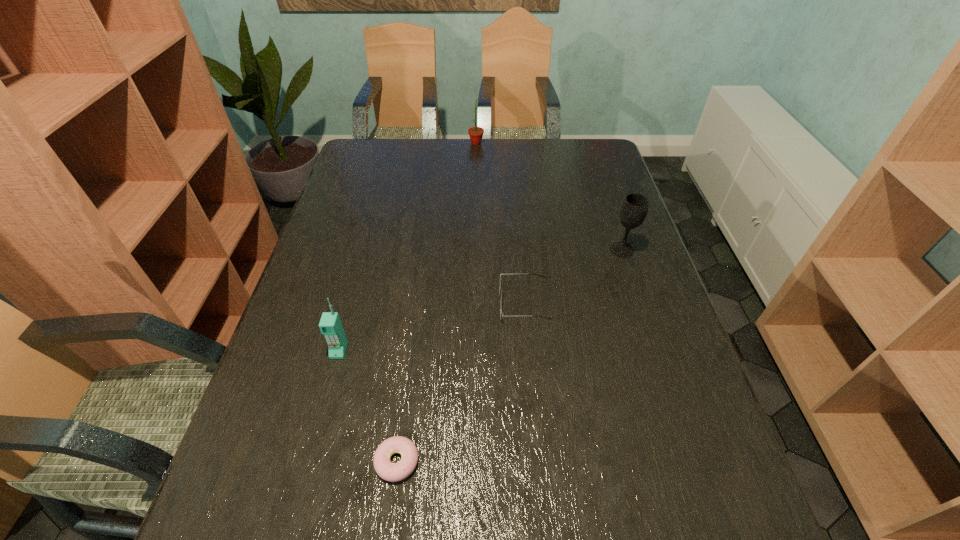
This screenshot has width=960, height=540. In order to click on vacant point located 0.060m on the face of the farthest object in this screenshot , I will do `click(500, 143)`.

Identify the location of free space located 0.380m on the front of the rightmost object. The image size is (960, 540). (664, 379).

Find the location of a particular element. free location located on the keypad of the fourth farthest object is located at coordinates (323, 414).

Find the location of a particular element. This screenshot has width=960, height=540. free space located on the front-facing side of the third farthest object is located at coordinates (396, 303).

At what (x,y) coordinates should I click in order to perform the action: click on vacant space located 0.330m on the front-facing side of the third farthest object. Please return your answer as a coordinate pair (x, y). Image resolution: width=960 pixels, height=540 pixels. Looking at the image, I should click on coord(368,303).

At what (x,y) coordinates should I click in order to perform the action: click on vacant region located on the front-facing side of the third farthest object. Please return your answer as a coordinate pair (x, y). Looking at the image, I should click on (360, 303).

Where is `free space located 0.250m on the right of the doughnut`? The width and height of the screenshot is (960, 540). free space located 0.250m on the right of the doughnut is located at coordinates (551, 461).

Locate an element on the screen. The height and width of the screenshot is (540, 960). object located in the far edge section of the desktop is located at coordinates (476, 133).

At what (x,y) coordinates should I click in order to perform the action: click on object that is at the left edge. Please return your answer as a coordinate pair (x, y). Looking at the image, I should click on (330, 325).

At what (x,y) coordinates should I click in order to perform the action: click on object that is at the right edge. Please return your answer as a coordinate pair (x, y). Looking at the image, I should click on coord(634,208).